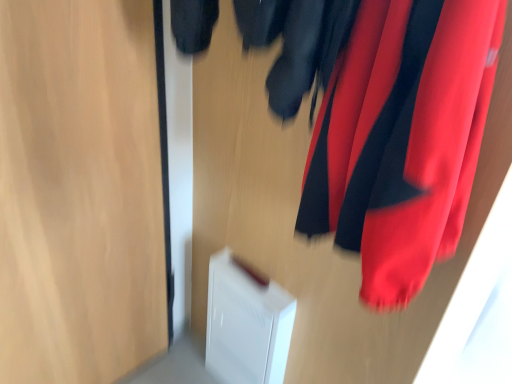
The width and height of the screenshot is (512, 384). What do you see at coordinates (79, 191) in the screenshot?
I see `transparent glass door at left` at bounding box center [79, 191].

What is the approximate width of transparent glass door at left?

transparent glass door at left is 3.19 inches in width.

Locate an element on the screen. This screenshot has width=512, height=384. transparent glass door at left is located at coordinates (79, 191).

Where is `satin red curtain at upper right`? satin red curtain at upper right is located at coordinates (402, 138).

Describe the element at coordinates (402, 138) in the screenshot. The height and width of the screenshot is (384, 512). I see `satin red curtain at upper right` at that location.

From the picture: In order to face satin red curtain at upper right, should I rotate leftwards or rightwards?

Turn right approximately 15.148 degrees to face it.

Where is `transparent glass door at left`? This screenshot has width=512, height=384. transparent glass door at left is located at coordinates (79, 191).

Is satin red curtain at upper right to the right of transparent glass door at left from the viewer's perspective?

Indeed, satin red curtain at upper right is positioned on the right side of transparent glass door at left.

Does satin red curtain at upper right lie in front of transparent glass door at left?

Yes, the depth of satin red curtain at upper right is less than that of transparent glass door at left.

Considering the points (433, 91) and (18, 105), which point is in front, point (433, 91) or point (18, 105)?

The point (433, 91) is in front.

Looking at this image, from the image's perspective, relative to transparent glass door at left, is satin red curtain at upper right above or below?

Clearly, from the image's perspective, satin red curtain at upper right is above transparent glass door at left.

From a real-world perspective, is satin red curtain at upper right physically below transparent glass door at left?

No.

Considering the relative sizes of satin red curtain at upper right and transparent glass door at left in the image provided, is satin red curtain at upper right thinner than transparent glass door at left?

In fact, satin red curtain at upper right might be wider than transparent glass door at left.

Is satin red curtain at upper right taller than transparent glass door at left?

No, satin red curtain at upper right is not taller than transparent glass door at left.

Consider the image. Does satin red curtain at upper right have a larger size compared to transparent glass door at left?

Incorrect, satin red curtain at upper right is not larger than transparent glass door at left.

Is satin red curtain at upper right completely or partially outside of transparent glass door at left?

Yes, satin red curtain at upper right is outside of transparent glass door at left.

Are satin red curtain at upper right and transparent glass door at left making contact?

satin red curtain at upper right and transparent glass door at left are not in contact.

Is satin red curtain at upper right turned away from transparent glass door at left?

satin red curtain at upper right does not have its back to transparent glass door at left.

What's the angular difference between satin red curtain at upper right and transparent glass door at left's facing directions?

There is a 88.9-degree angle between the facing directions of satin red curtain at upper right and transparent glass door at left.

Identify the location of glass door that appears on the left of satin red curtain at upper right. (79, 191).

Based on their positions, is transparent glass door at left located to the left or right of satin red curtain at upper right?

transparent glass door at left is positioned on satin red curtain at upper right's left side.

Who is more distant, transparent glass door at left or satin red curtain at upper right?

transparent glass door at left is more distant.

Considering the positions of point (67, 233) and point (390, 221), is point (67, 233) closer or farther from the camera than point (390, 221)?

Point (67, 233) is positioned farther from the camera compared to point (390, 221).

From the image's perspective, does transparent glass door at left appear lower than satin red curtain at upper right?

Yes, from the image's perspective, transparent glass door at left is below satin red curtain at upper right.

From a real-world perspective, relative to satin red curtain at upper right, is transparent glass door at left vertically above or below?

From a real-world perspective, transparent glass door at left is physically below satin red curtain at upper right.

Can you confirm if transparent glass door at left is thinner than satin red curtain at upper right?

Yes.

Which of these two, transparent glass door at left or satin red curtain at upper right, stands shorter?

satin red curtain at upper right.

Is transparent glass door at left smaller than satin red curtain at upper right?

No.

Is satin red curtain at upper right located within transparent glass door at left?

That's incorrect, satin red curtain at upper right is not inside transparent glass door at left.

Would you consider transparent glass door at left to be distant from satin red curtain at upper right?

They are positioned close to each other.

Is transparent glass door at left turned away from satin red curtain at upper right?

No, transparent glass door at left's orientation is not away from satin red curtain at upper right.

How many degrees apart are the facing directions of transparent glass door at left and satin red curtain at upper right?

88.9 degrees separate the facing orientations of transparent glass door at left and satin red curtain at upper right.

How far apart are transparent glass door at left and satin red curtain at upper right?

The distance of transparent glass door at left from satin red curtain at upper right is 26.10 inches.

The width and height of the screenshot is (512, 384). In order to click on curtain that appears above the transparent glass door at left (from a real-world perspective) in this screenshot , I will do `click(402, 138)`.

At what (x,y) coordinates should I click in order to perform the action: click on glass door located on the left of satin red curtain at upper right. Please return your answer as a coordinate pair (x, y). Looking at the image, I should click on (79, 191).

Image resolution: width=512 pixels, height=384 pixels. Identify the location of glass door below the satin red curtain at upper right (from a real-world perspective). coord(79,191).